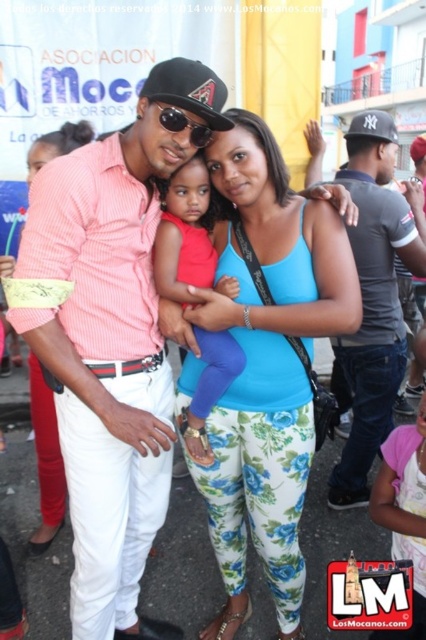
Question: Does black cotton t-shirt at right appear over matte red dress at center?

Choices:
 (A) yes
 (B) no

Answer: (A)

Question: Which point appears farthest from the camera in this image?

Choices:
 (A) (141, 97)
 (B) (368, 244)
 (C) (213, 396)

Answer: (B)

Question: Can you confirm if black cotton t-shirt at right is wider than black matte baseball cap at center?

Choices:
 (A) yes
 (B) no

Answer: (A)

Question: Which of the following is the closest to the observer?

Choices:
 (A) (305, 241)
 (B) (363, 179)

Answer: (A)

Question: Which object is positioned closest to the black cotton t-shirt at right?

Choices:
 (A) matte pink shirt at center
 (B) blue floral leggings at center
 (C) matte red dress at center
 (D) black matte baseball cap at center

Answer: (B)

Question: Can you confirm if matte pink shirt at center is positioned above black cotton t-shirt at right?

Choices:
 (A) no
 (B) yes

Answer: (A)